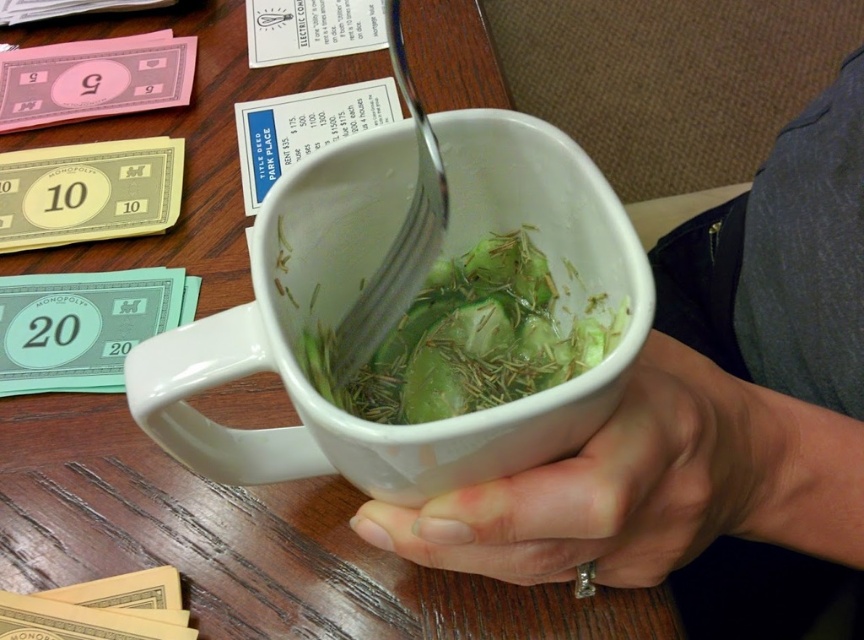
Is green paper money at upper left further to the viewer compared to gold paper money at lower left?

Yes, green paper money at upper left is further from the viewer.

Between green paper money at upper left and gold paper money at lower left, which one appears on the left side from the viewer's perspective?

From the viewer's perspective, green paper money at upper left appears more on the left side.

Between point (131, 204) and point (56, 620), which one is positioned behind?

The point (131, 204) is more distant.

At what (x,y) coordinates should I click in order to perform the action: click on green paper money at upper left. Please return your answer as a coordinate pair (x, y). The height and width of the screenshot is (640, 864). Looking at the image, I should click on (87, 192).

Is white ceramic mug at center smaller than green paper money at left?

No, white ceramic mug at center is not smaller than green paper money at left.

Which is below, white ceramic mug at center or green paper money at left?

white ceramic mug at center

What do you see at coordinates (356, 292) in the screenshot?
I see `white ceramic mug at center` at bounding box center [356, 292].

This screenshot has height=640, width=864. Find the location of `white ceramic mug at center`. white ceramic mug at center is located at coordinates (356, 292).

Is smooth white mug at center positioned before green leafy vegetable at center?

Yes, smooth white mug at center is in front of green leafy vegetable at center.

Is smooth white mug at center behind green leafy vegetable at center?

No, smooth white mug at center is closer to the viewer.

Between point (515, 477) and point (487, 388), which one is positioned behind?

The point (487, 388) is more distant.

Where is `smooth white mug at center`? The image size is (864, 640). smooth white mug at center is located at coordinates (613, 486).